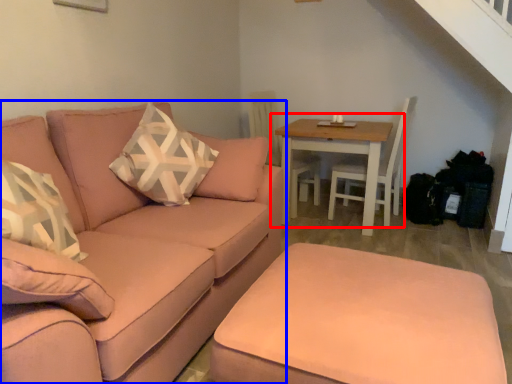
Question: Which point is closer to the camera, table (highlighted by a red box) or studio couch (highlighted by a blue box)?

Choices:
 (A) table
 (B) studio couch

Answer: (B)